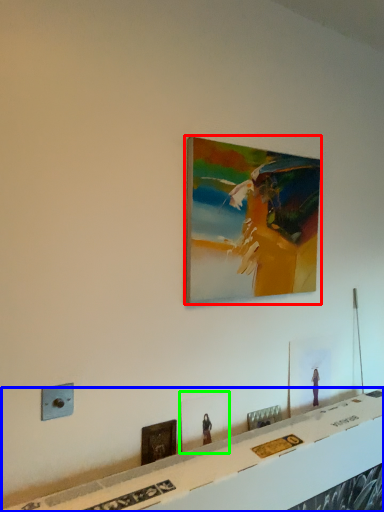
Question: Which is farther away from picture frame (highlighted by a red box)? table (highlighted by a blue box) or picture frame (highlighted by a green box)?

Choices:
 (A) table
 (B) picture frame

Answer: (A)